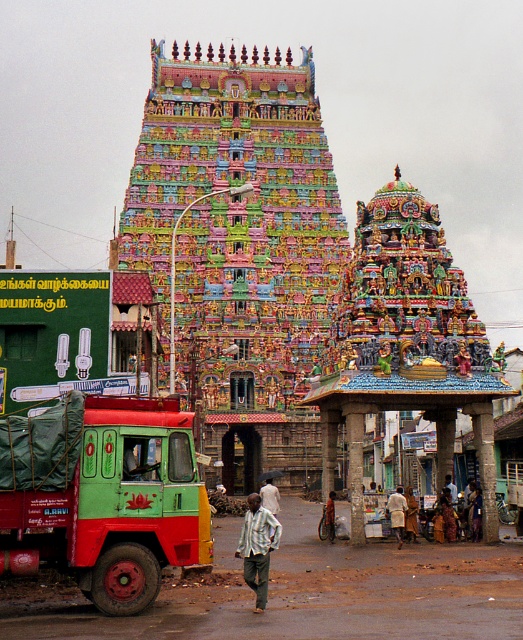
Question: Is multicolored painted temple at center thinner than light brown fabric dress at center?

Choices:
 (A) no
 (B) yes

Answer: (A)

Question: Can you confirm if multicolored painted temple at center is thinner than white fabric at center?

Choices:
 (A) yes
 (B) no

Answer: (B)

Question: Can you confirm if carved stone pillar at center is smaller than white fabric at center?

Choices:
 (A) no
 (B) yes

Answer: (A)

Question: Which object is closer to the camera taking this photo?

Choices:
 (A) orange fabric shirt at center
 (B) green matte truck at lower left
 (C) light green fabric pants at center

Answer: (B)

Question: Which object is closer to the camera taking this photo?

Choices:
 (A) light green fabric pants at center
 (B) light blue fabric shirt at center
 (C) green matte truck at lower left
 (D) white fabric at center

Answer: (C)

Question: Estimate the real-world distances between objects in this image. Which object is closer to the light green fabric pants at center?

Choices:
 (A) light blue fabric shirt at center
 (B) light brown fabric dress at center
 (C) orange fabric shirt at center

Answer: (B)